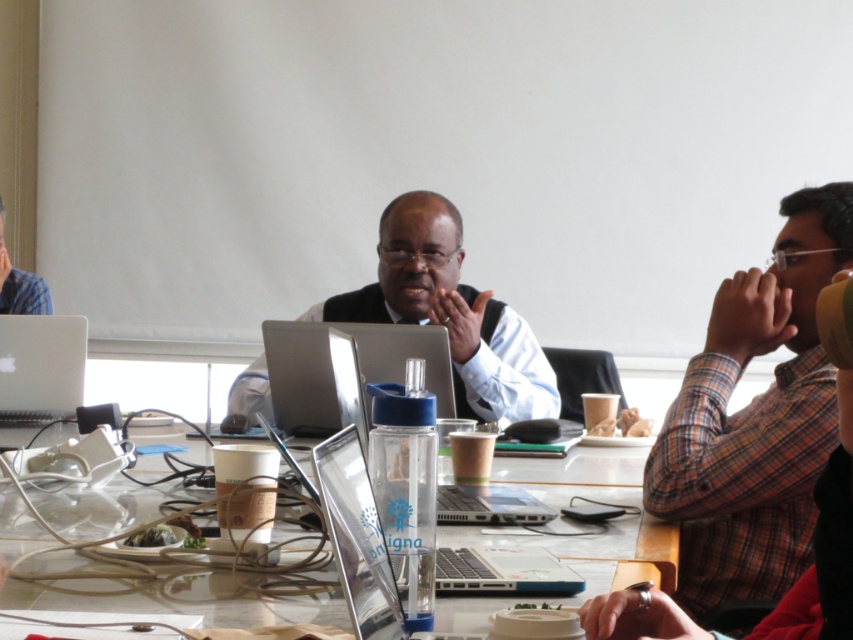
Does clear plastic laptop at center have a smaller size compared to white glossy laptop at left?

Actually, clear plastic laptop at center might be larger than white glossy laptop at left.

Who is lower down, clear plastic laptop at center or white glossy laptop at left?

clear plastic laptop at center is lower down.

Find the location of `clear plastic laptop at center`. clear plastic laptop at center is located at coordinates (402, 355).

At what (x,y) coordinates should I click in order to perform the action: click on clear plastic laptop at center. Please return your answer as a coordinate pair (x, y). Looking at the image, I should click on (402, 355).

Can you confirm if plaid shirt at right is positioned above clear plastic laptop at center?

Indeed, plaid shirt at right is positioned over clear plastic laptop at center.

In order to click on plaid shirt at right in this screenshot , I will do `click(753, 419)`.

How far apart are plaid shirt at right and matte black vest at center?

plaid shirt at right and matte black vest at center are 34.81 inches apart from each other.

Identify the location of plaid shirt at right. The height and width of the screenshot is (640, 853). (753, 419).

Locate an element on the screen. plaid shirt at right is located at coordinates (753, 419).